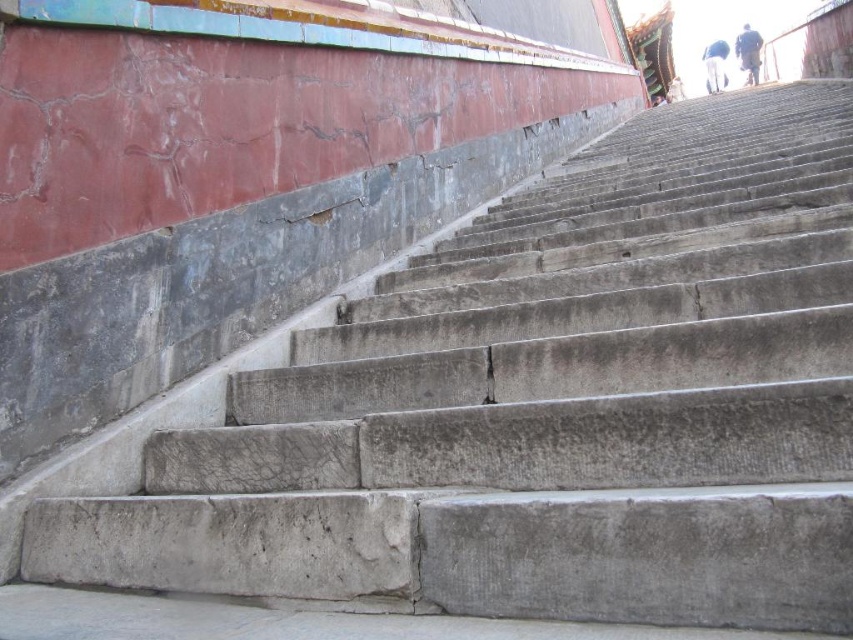
Does brown leather pants at upper right have a smaller size compared to white cotton pants at upper right?

Correct, brown leather pants at upper right occupies less space than white cotton pants at upper right.

Is point (741, 44) in front of point (712, 65)?

Yes.

Image resolution: width=853 pixels, height=640 pixels. In order to click on brown leather pants at upper right in this screenshot , I will do `click(747, 51)`.